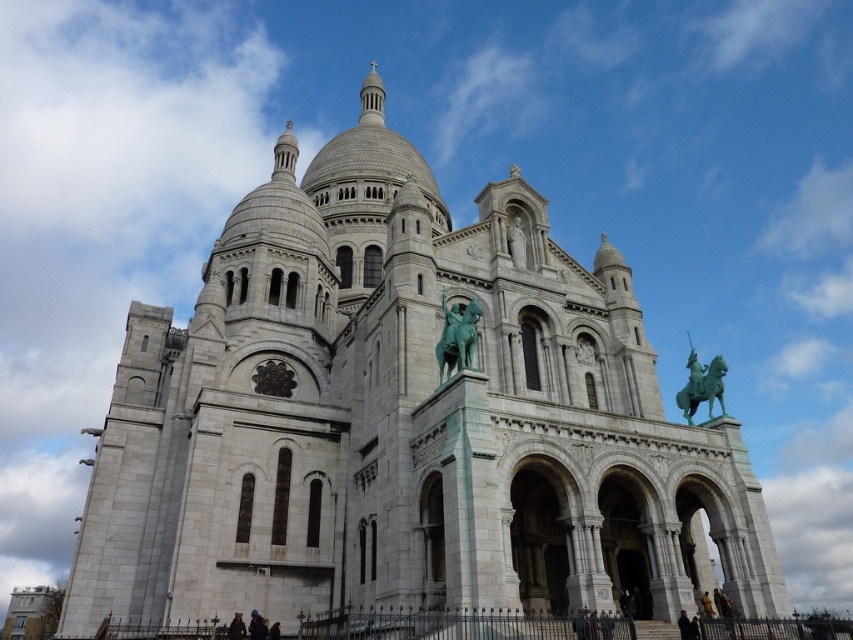
Question: Which point is closer to the camera?

Choices:
 (A) (468, 321)
 (B) (691, 419)

Answer: (A)

Question: Does green patina statue at center appear over green patina horse at upper right?

Choices:
 (A) no
 (B) yes

Answer: (B)

Question: Is green patina statue at center in front of green patina horse at upper right?

Choices:
 (A) no
 (B) yes

Answer: (B)

Question: Which point is closer to the camera taking this photo?

Choices:
 (A) (695, 365)
 (B) (459, 365)

Answer: (B)

Question: Does green patina statue at center have a greater width compared to green patina horse at upper right?

Choices:
 (A) yes
 (B) no

Answer: (B)

Question: Which point is farther from the camera taking this photo?

Choices:
 (A) (468, 317)
 (B) (683, 387)

Answer: (B)